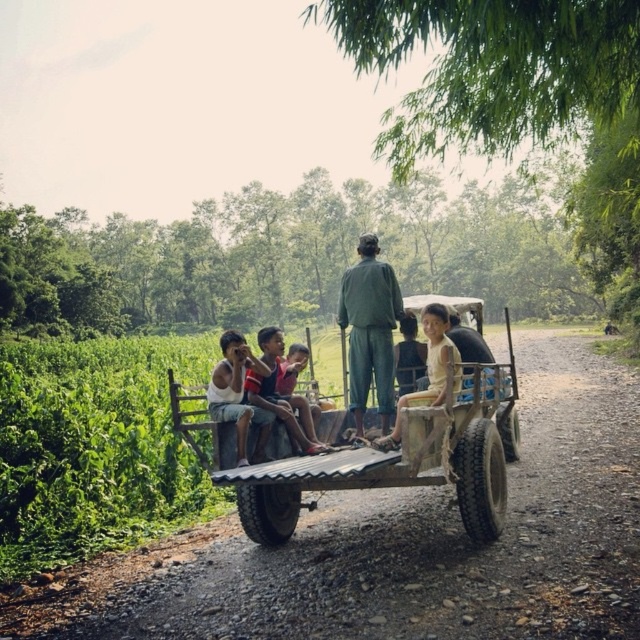
Question: Which object is farther from the camera taking this photo?

Choices:
 (A) light beige fabric shirt at center
 (B) brown gravel road at center

Answer: (A)

Question: Is brown gravel road at center below green fabric shirt at center?

Choices:
 (A) no
 (B) yes

Answer: (B)

Question: Which is nearer to the wooden cart at center?

Choices:
 (A) light brown fabric shirt at center
 (B) brown gravel road at center
 (C) light beige fabric shirt at center
 (D) green fabric shirt at center

Answer: (C)

Question: Is green fabric shirt at center thinner than light brown fabric shirt at center?

Choices:
 (A) yes
 (B) no

Answer: (B)

Question: Is brown gravel road at center positioned behind light beige fabric shirt at center?

Choices:
 (A) no
 (B) yes

Answer: (A)

Question: Based on their relative distances, which object is nearer to the light beige fabric shirt at center?

Choices:
 (A) green fabric shirt at center
 (B) wooden cart at center
 (C) brown gravel road at center
 (D) light brown fabric shirt at center

Answer: (B)